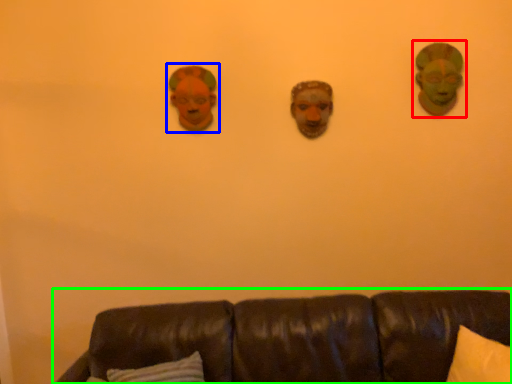
Question: Considering the real-world distances, which object is farthest from person (highlighted by a red box)? decor (highlighted by a blue box) or studio couch (highlighted by a green box)?

Choices:
 (A) decor
 (B) studio couch

Answer: (B)